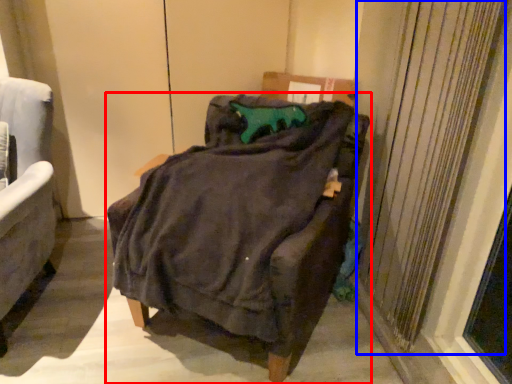
Question: Which object is closer to the camera taking this photo, chair (highlighted by a red box) or curtain (highlighted by a blue box)?

Choices:
 (A) chair
 (B) curtain

Answer: (A)